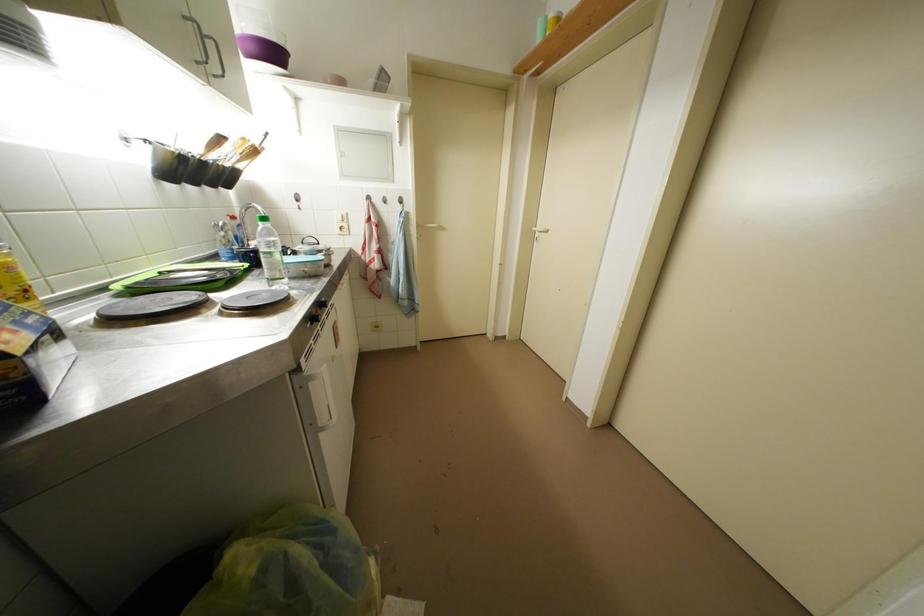
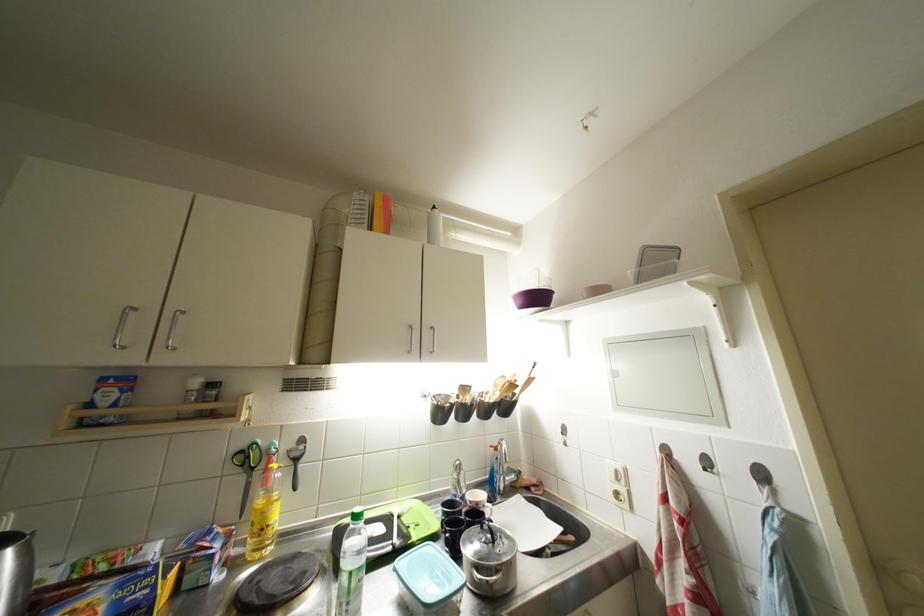
Find the pixel in the second image that matches the point at 261,155 in the first image.

(519, 390)